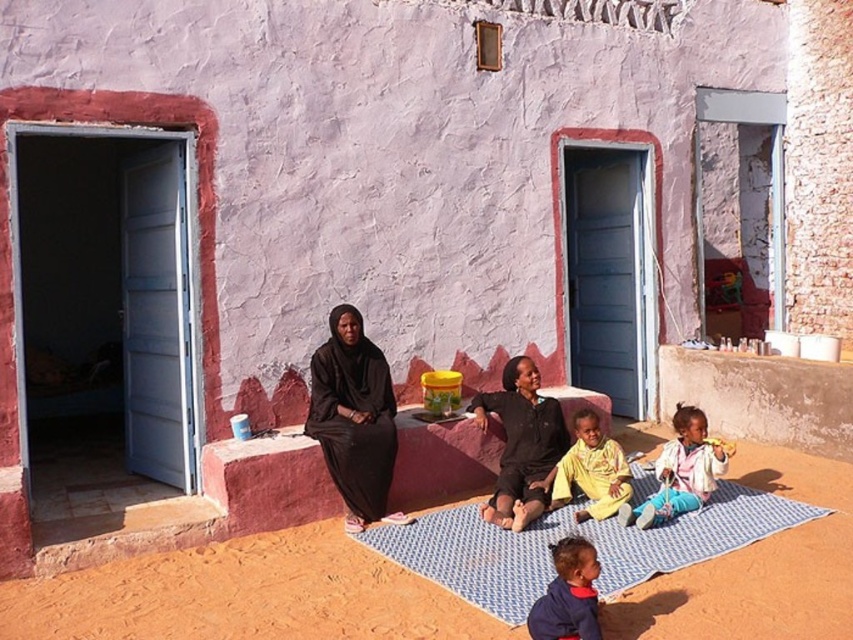
Question: Does black fabric children at center come behind yellow cotton shirt at center?

Choices:
 (A) no
 (B) yes

Answer: (A)

Question: Among these objects, which one is nearest to the camera?

Choices:
 (A) yellow cotton shirt at center
 (B) blue woven mat at lower center
 (C) black matte dress at center
 (D) light pink fabric pants at lower right

Answer: (B)

Question: Is black fabric children at center above yellow cotton shirt at center?

Choices:
 (A) yes
 (B) no

Answer: (A)

Question: Does light pink fabric pants at lower right have a lesser width compared to yellow cotton shirt at center?

Choices:
 (A) no
 (B) yes

Answer: (A)

Question: Which of the following is the farthest from the observer?

Choices:
 (A) yellow cotton shirt at center
 (B) blue woven mat at lower center

Answer: (A)

Question: Which point is farther from the camera taking this photo?

Choices:
 (A) (701, 500)
 (B) (502, 404)

Answer: (B)